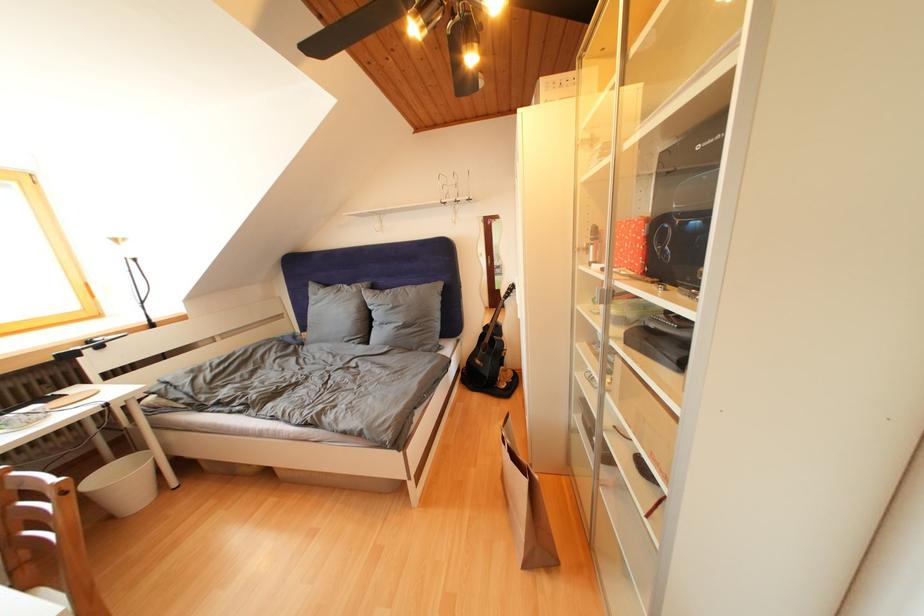
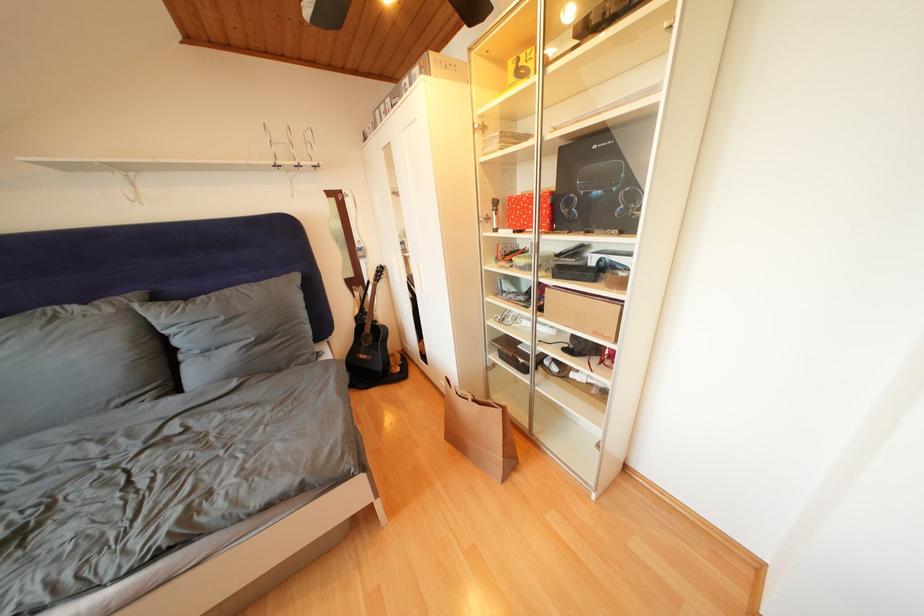
Question: Based on the continuous images, in which direction is the camera rotating? Reply with the corresponding letter.

Choices:
 (A) Left
 (B) Right
 (C) Up
 (D) Down

Answer: (B)